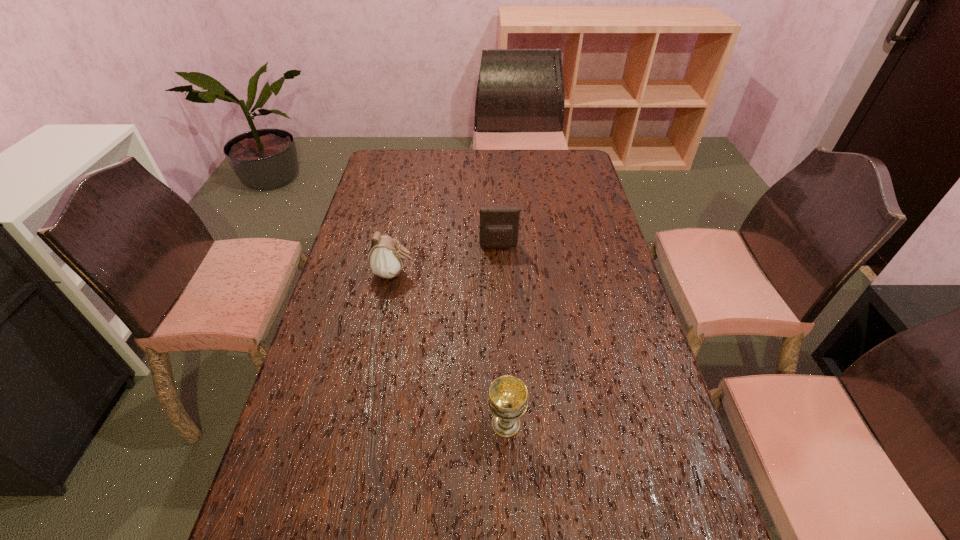
The width and height of the screenshot is (960, 540). In the image, there is a desktop. Identify the location of vacant space at the left edge. (305, 406).

In the image, there is a desktop. At what (x,y) coordinates should I click in order to perform the action: click on blank space at the right edge. Please return your answer as a coordinate pair (x, y). This screenshot has width=960, height=540. Looking at the image, I should click on (629, 289).

In the image, there is a desktop. Where is `blank space at the far right corner`? This screenshot has width=960, height=540. blank space at the far right corner is located at coordinates point(589,177).

Locate an element on the screen. Image resolution: width=960 pixels, height=540 pixels. free spot between the nearest object and the right pouch is located at coordinates (502, 335).

This screenshot has width=960, height=540. Find the location of `unoccupied area between the farthest object and the chalice`. unoccupied area between the farthest object and the chalice is located at coordinates (502, 335).

Where is `blank region between the farthest object and the second farthest object`? blank region between the farthest object and the second farthest object is located at coordinates (446, 260).

This screenshot has height=540, width=960. Identify the location of vacant area that lies between the chalice and the nearer pouch. (450, 348).

Identify the location of unoccupied position between the nearest object and the second farthest object. (450, 348).

Find the location of `vacant area between the second farthest object and the nearest object`. vacant area between the second farthest object and the nearest object is located at coordinates (450, 348).

At what (x,y) coordinates should I click in order to perform the action: click on vacant space that's between the second nearest object and the farthest object. Please return your answer as a coordinate pair (x, y). The width and height of the screenshot is (960, 540). Looking at the image, I should click on (446, 260).